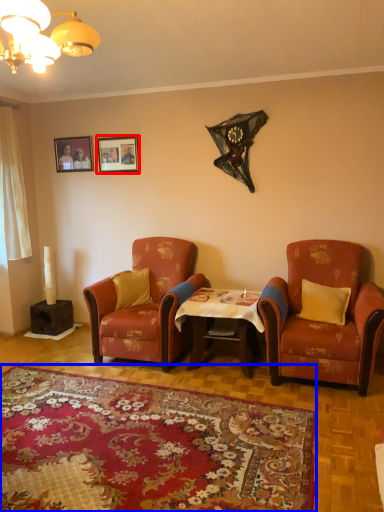
Question: Which of the following is the farthest to the observer, picture frame (highlighted by a red box) or plain (highlighted by a blue box)?

Choices:
 (A) picture frame
 (B) plain

Answer: (A)